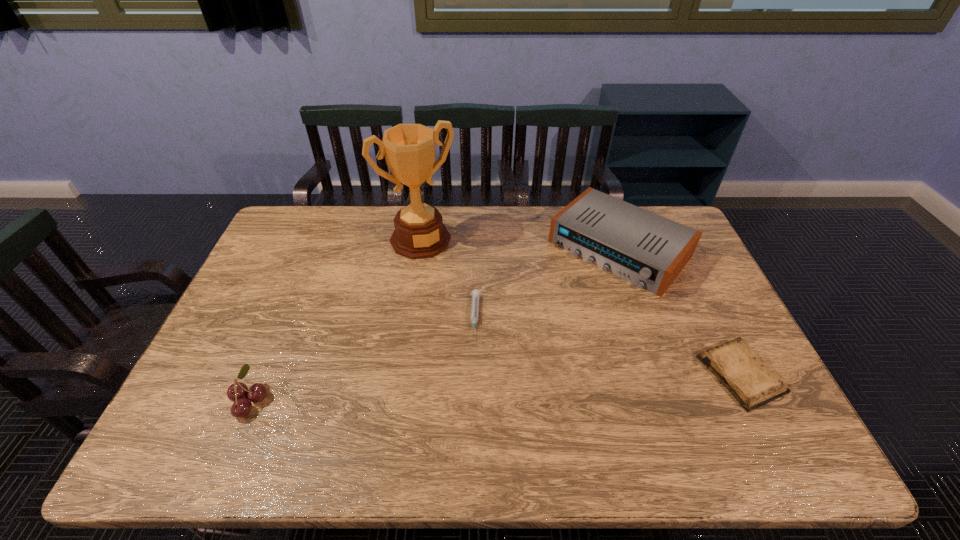
Where is `the leftmost object`? the leftmost object is located at coordinates (237, 392).

In order to click on diary in this screenshot , I will do `click(737, 366)`.

This screenshot has width=960, height=540. In order to click on syringe in this screenshot , I will do `click(475, 294)`.

The width and height of the screenshot is (960, 540). Identify the location of the third object from right to left. (475, 294).

I want to click on radio receiver, so click(x=644, y=248).

Locate an element on the screen. The image size is (960, 540). the fourth object from right to left is located at coordinates (409, 149).

This screenshot has width=960, height=540. Identify the location of award. (409, 149).

Find the location of a particular element. The image size is (960, 540). free space located 0.050m on the leaves of the leftmost object is located at coordinates (210, 400).

Where is `free space located 0.080m on the leaves of the leftmost object`? free space located 0.080m on the leaves of the leftmost object is located at coordinates (198, 400).

Image resolution: width=960 pixels, height=540 pixels. I want to click on free region located 0.260m on the left of the fourth tallest object, so coord(602,374).